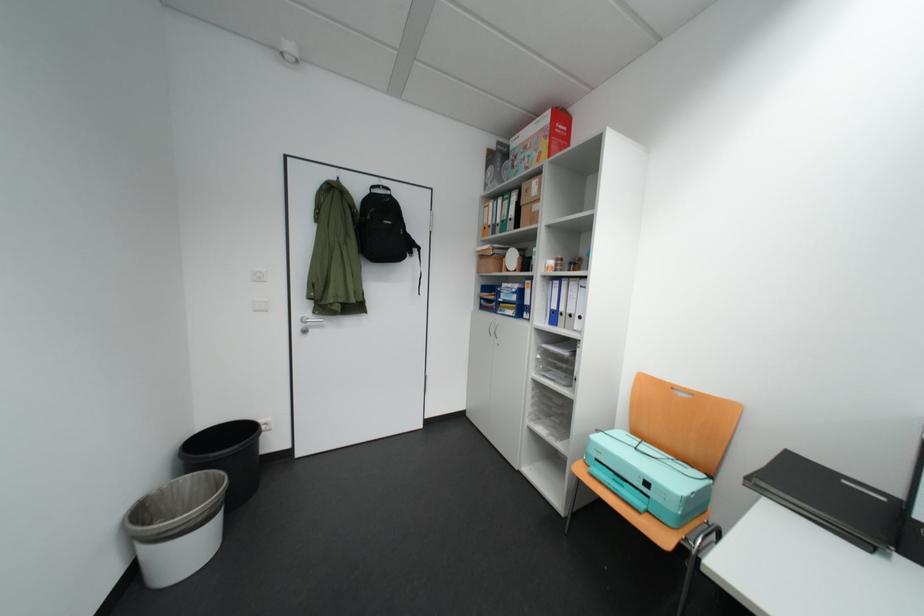
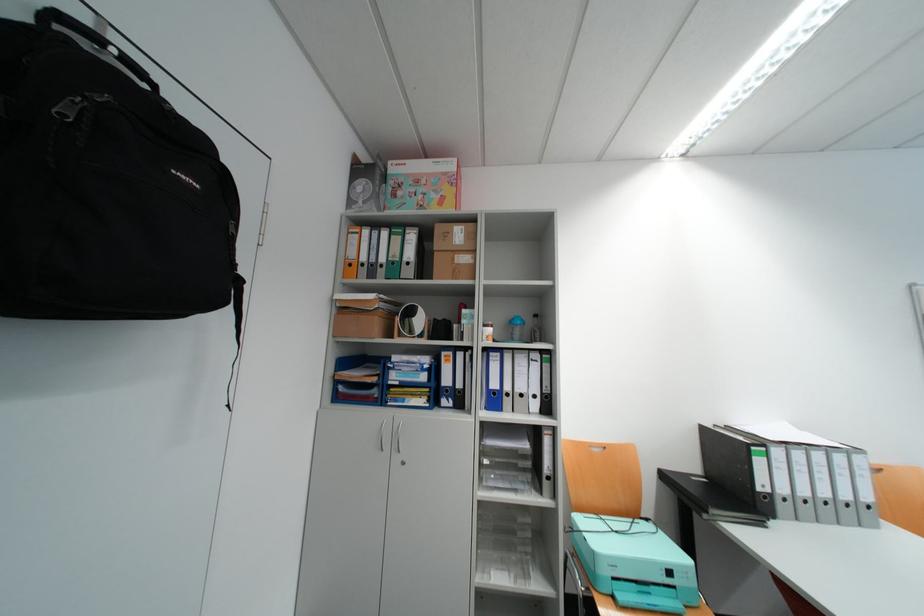
Where in the second image is the point corresponding to (x=383, y=188) from the first image?

(73, 20)